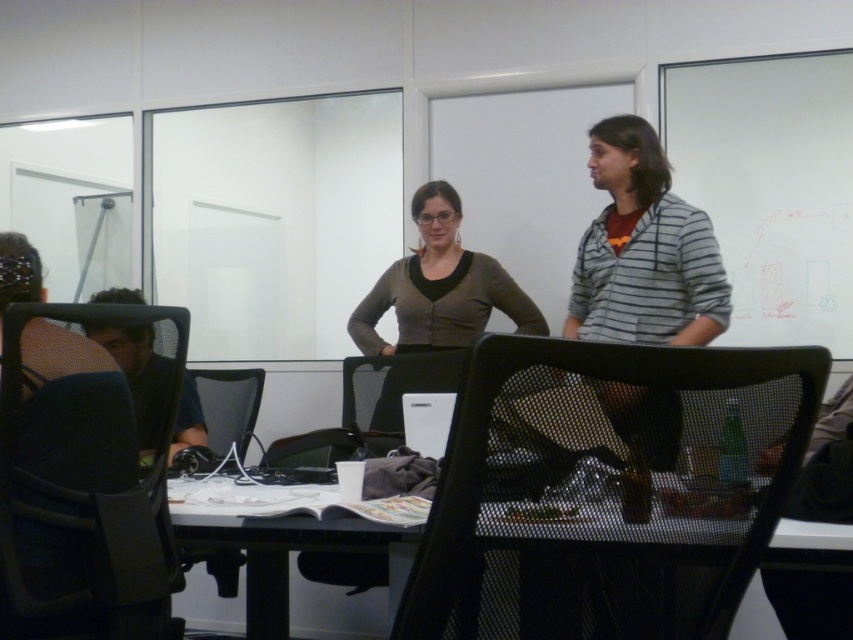
Question: Is matte brown cardigan at center smaller than dark blue shirt at left?

Choices:
 (A) yes
 (B) no

Answer: (B)

Question: Does matte brown cardigan at center have a greater width compared to dark blue shirt at left?

Choices:
 (A) no
 (B) yes

Answer: (B)

Question: Which is nearer to the dark blue shirt at left?

Choices:
 (A) matte brown cardigan at center
 (B) black mesh table at center

Answer: (B)

Question: Among these objects, which one is farthest from the camera?

Choices:
 (A) matte brown cardigan at center
 (B) black mesh table at center

Answer: (A)

Question: Considering the real-world distances, which object is farthest from the dark blue shirt at left?

Choices:
 (A) black mesh table at center
 (B) matte brown cardigan at center

Answer: (B)

Question: Is black mesh table at center to the left of dark blue shirt at left from the viewer's perspective?

Choices:
 (A) yes
 (B) no

Answer: (B)